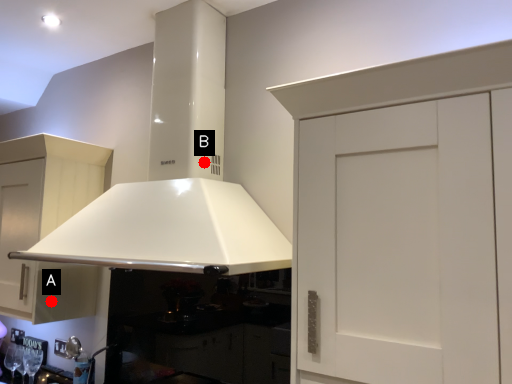
Question: Two points are circled on the image, labeled by A and B beside each circle. Which point is farther to the camera?

Choices:
 (A) A is further
 (B) B is further

Answer: (A)